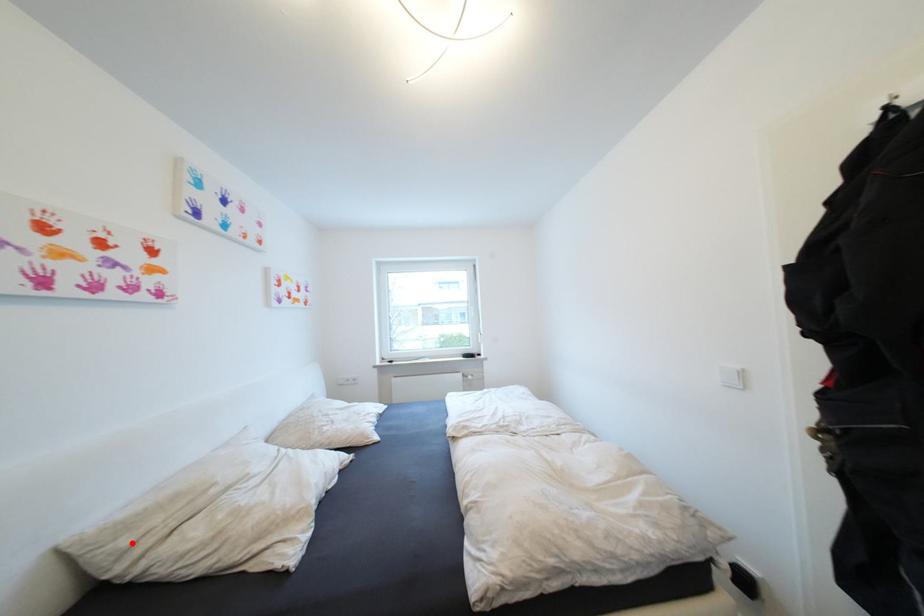
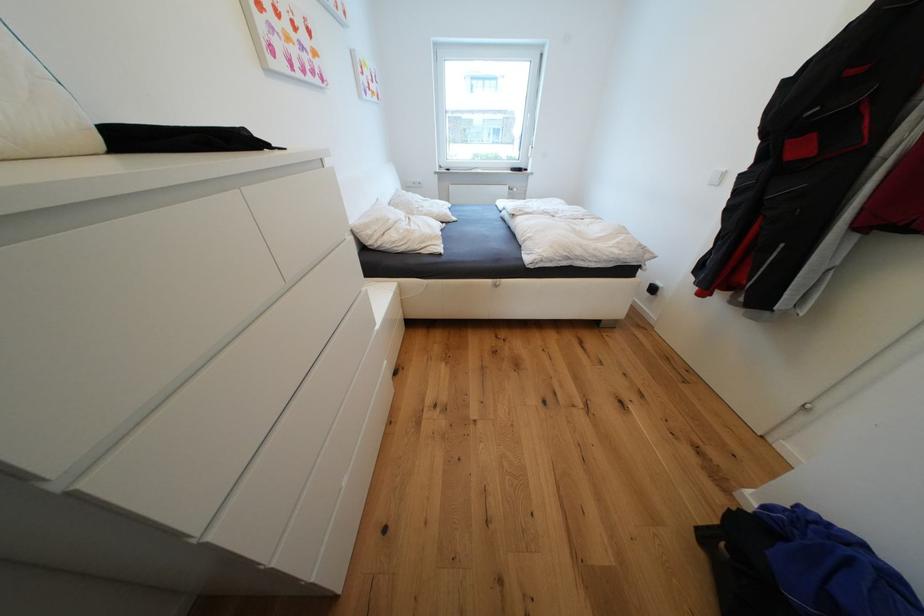
The point at the highlighted location is marked in the first image. Where is the corresponding point in the second image?

(377, 233)